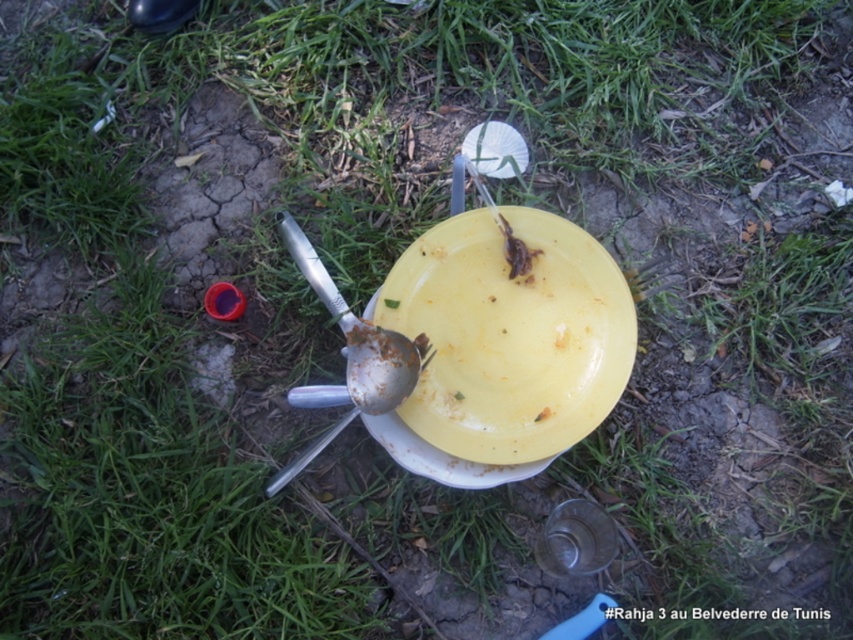
Question: Does yellow matte plate at center have a larger size compared to silver metallic spoon at center?

Choices:
 (A) yes
 (B) no

Answer: (A)

Question: Is yellow matte plate at center smaller than silver metallic spoon at center?

Choices:
 (A) yes
 (B) no

Answer: (B)

Question: Does yellow matte plate at center have a lesser width compared to silver metallic spoon at center?

Choices:
 (A) no
 (B) yes

Answer: (A)